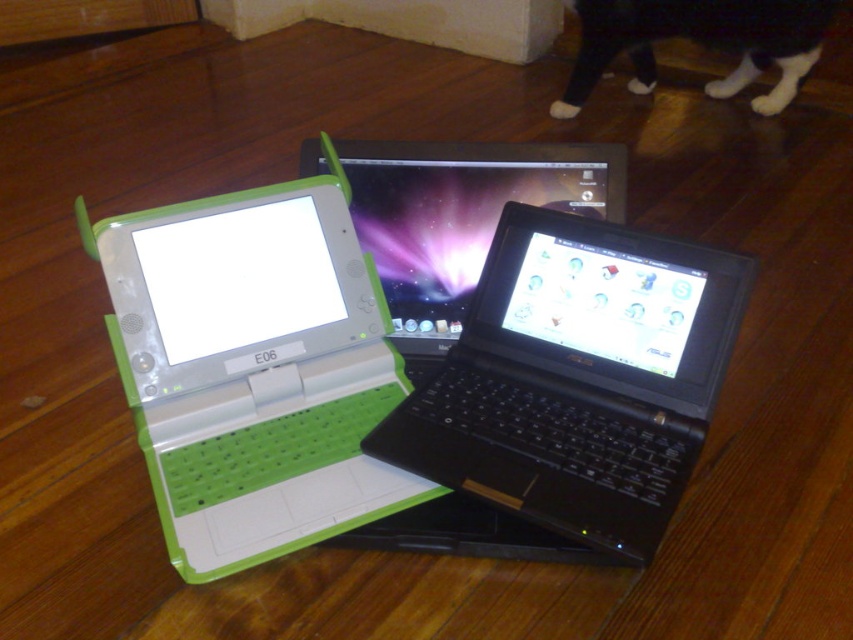
Question: Can you confirm if black plastic laptop at center is positioned to the right of black glossy laptop at center?

Choices:
 (A) yes
 (B) no

Answer: (A)

Question: Based on their relative distances, which object is nearer to the black plastic laptop at center?

Choices:
 (A) black glossy laptop at center
 (B) green matte laptop at center
 (C) black fur at upper center

Answer: (A)

Question: Which object appears farthest from the camera in this image?

Choices:
 (A) green matte laptop at center
 (B) black plastic laptop at center

Answer: (A)

Question: Among these objects, which one is nearest to the camera?

Choices:
 (A) black plastic laptop at center
 (B) black glossy laptop at center
 (C) green matte laptop at center
 (D) black fur at upper center

Answer: (A)

Question: In this image, where is black glossy laptop at center located relative to black fur at upper center?

Choices:
 (A) right
 (B) left

Answer: (B)

Question: Does green matte laptop at center have a lesser width compared to black glossy laptop at center?

Choices:
 (A) yes
 (B) no

Answer: (A)